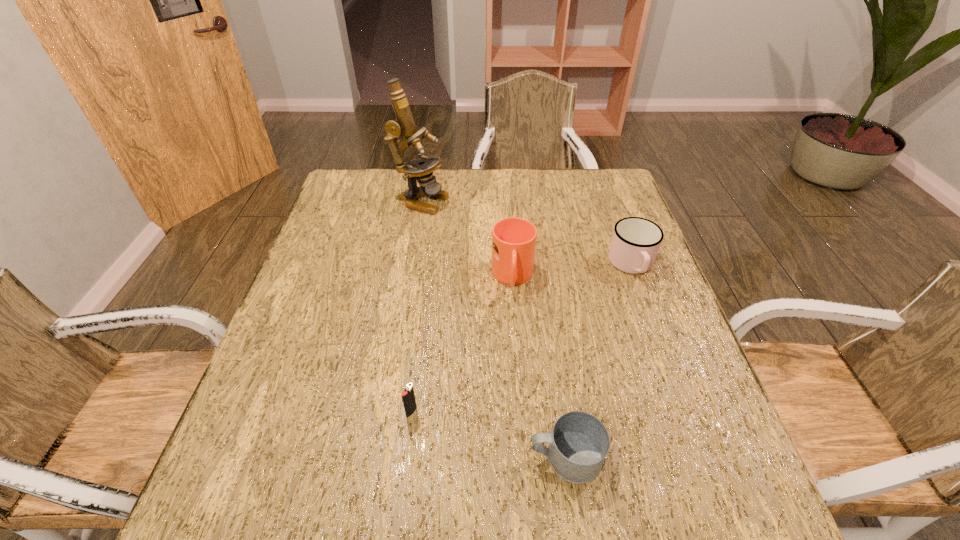
In order to click on object that can be found as the fourth closest to the rightmost object in this screenshot , I will do `click(408, 397)`.

You are a GUI agent. You are given a task and a screenshot of the screen. Output one action in this format:
    pyautogui.click(x=<x>, y=<y>)
    Task: Click on the mug that is the second closest to the second nearest object
    Image resolution: width=960 pixels, height=540 pixels.
    Given the screenshot: What is the action you would take?
    pyautogui.click(x=514, y=239)

Identify which mug is located as the second nearest to the nearest mug. Please provide its 2D coordinates. Your answer should be formatted as a tuple, i.e. [(x, y)], where the tuple contains the x and y coordinates of a point satisfying the conditions above.

[(635, 243)]

This screenshot has height=540, width=960. I want to click on vacant space that satisfies the following two spatial constraints: 1. on the front side of the microscope; 2. on the right side of the igniter, so click(385, 411).